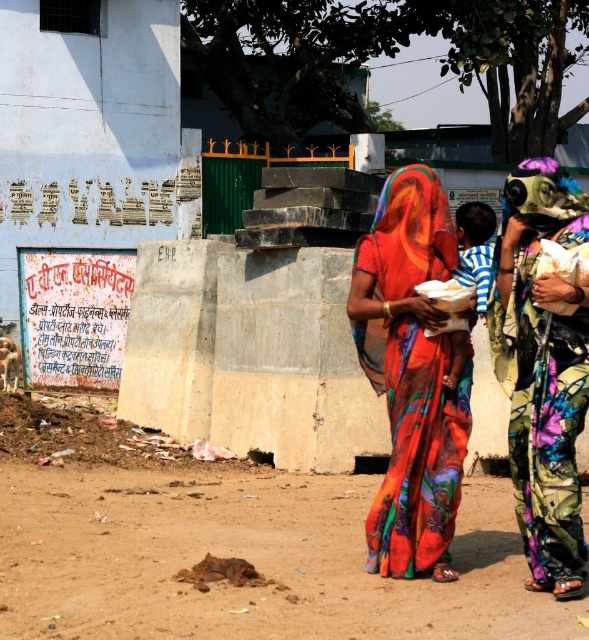
Image resolution: width=589 pixels, height=640 pixels. What do you see at coordinates (229, 548) in the screenshot?
I see `brown dirt field at lower left` at bounding box center [229, 548].

This screenshot has width=589, height=640. Identify the location of brown dirt field at lower left. (229, 548).

Does multicolored fabric saree at right have a greater height compared to striped cotton shirt at center?

Correct, multicolored fabric saree at right is much taller as striped cotton shirt at center.

Can you confirm if multicolored fabric saree at right is smaller than striped cotton shirt at center?

Actually, multicolored fabric saree at right might be larger than striped cotton shirt at center.

Is point (527, 308) positioned before point (491, 273)?

Yes, it is in front of point (491, 273).

At what (x,y) coordinates should I click in order to perform the action: click on multicolored fabric saree at right. Please return your answer as a coordinate pair (x, y). The image size is (589, 640). Looking at the image, I should click on tap(542, 369).

Can you confirm if brown dirt field at lower left is wider than multicolored fabric saree at right?

In fact, brown dirt field at lower left might be narrower than multicolored fabric saree at right.

Is point (57, 576) closer to viewer compared to point (567, 470)?

No, (57, 576) is further to viewer.

Locate an element on the screen. This screenshot has width=589, height=640. brown dirt field at lower left is located at coordinates (229, 548).